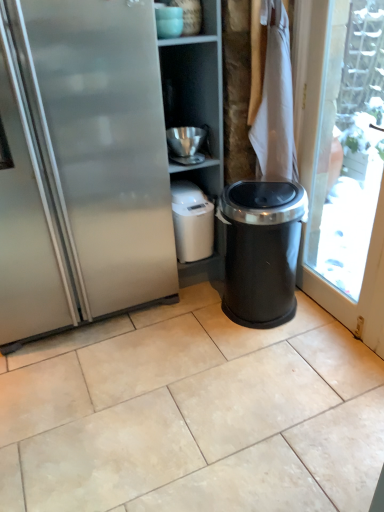
The image size is (384, 512). I want to click on space that is in front of stainless steel fridge at left, so click(137, 394).